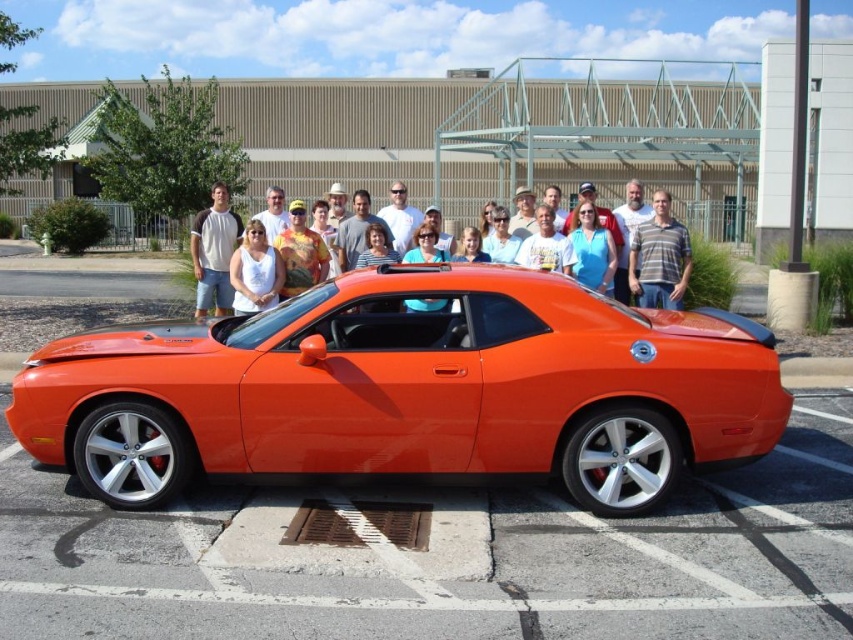
You are standing in the parking lot and want to walk to the point that is closer to you. Which point should you walk towards, point (807, 422) or point (641, 243)?

You should walk towards point (807, 422) because it is closer to the viewer than point (641, 243).

In the scene shown: Where is the glossy orange car at center located in the image?

The glossy orange car at center is located at point [444,557] in the image.

Consider the image. You are a photographer trying to capture a photo of the glossy orange sports car at center and the striped cotton shirt at center. Since you want to focus on the car, which object should you position closer to the camera?

The glossy orange sports car at center is located below striped cotton shirt at center, so to focus on the car, you should position the glossy orange sports car at center closer to the camera.